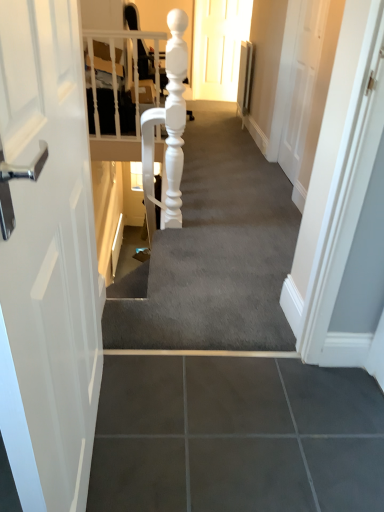
This screenshot has height=512, width=384. I want to click on matte white door at upper center, so click(218, 47).

Measure the distance between point (216, 10) and camera.

They are 17.95 feet apart.

Describe the element at coordinates (218, 47) in the screenshot. I see `matte white door at upper center` at that location.

Describe the element at coordinates (214, 255) in the screenshot. I see `smooth gray carpet at center` at that location.

Where is `smooth gray carpet at center`? This screenshot has height=512, width=384. smooth gray carpet at center is located at coordinates (214, 255).

At what (x,y) coordinates should I click in order to perform the action: click on matte white door at upper center. Please return your answer as a coordinate pair (x, y). The height and width of the screenshot is (512, 384). Looking at the image, I should click on point(218,47).

Which is more to the right, matte white door at upper center or smooth gray carpet at center?

matte white door at upper center.

Between matte white door at upper center and smooth gray carpet at center, which one is positioned in front?

smooth gray carpet at center is more forward.

Which point is more forward, (223, 89) or (158, 286)?

Positioned in front is point (158, 286).

From the image's perspective, is matte white door at upper center above or below smooth gray carpet at center?

From the image's perspective, matte white door at upper center appears above smooth gray carpet at center.

From a real-world perspective, does matte white door at upper center sit lower than smooth gray carpet at center?

No, from a real-world perspective, matte white door at upper center is not below smooth gray carpet at center.

Which object is wider, matte white door at upper center or smooth gray carpet at center?

Wider between the two is smooth gray carpet at center.

Considering the sizes of matte white door at upper center and smooth gray carpet at center in the image, is matte white door at upper center taller or shorter than smooth gray carpet at center?

In the image, matte white door at upper center appears to be taller than smooth gray carpet at center.

Which of these two, matte white door at upper center or smooth gray carpet at center, is smaller?

Smaller between the two is matte white door at upper center.

Can we say matte white door at upper center lies outside smooth gray carpet at center?

matte white door at upper center is positioned outside smooth gray carpet at center.

Would you consider matte white door at upper center to be distant from smooth gray carpet at center?

Yes, matte white door at upper center is far from smooth gray carpet at center.

In the scene shown: Is matte white door at upper center turned away from smooth gray carpet at center?

No, matte white door at upper center is not facing the opposite direction of smooth gray carpet at center.

Looking at this image, what's the angular difference between matte white door at upper center and smooth gray carpet at center's facing directions?

There is a 0.175-degree angle between the facing directions of matte white door at upper center and smooth gray carpet at center.

How much distance is there between matte white door at upper center and smooth gray carpet at center?

10.35 feet.

Where is `stairwell that is under the matte white door at upper center (from a real-world perspective)`? stairwell that is under the matte white door at upper center (from a real-world perspective) is located at coordinates (214, 255).

In the scene shown: Between smooth gray carpet at center and matte white door at upper center, which one appears on the left side from the viewer's perspective?

smooth gray carpet at center is more to the left.

Is smooth gray carpet at center closer to camera compared to matte white door at upper center?

Yes, the depth of smooth gray carpet at center is less than that of matte white door at upper center.

Considering the positions of points (223, 305) and (247, 3), is point (223, 305) farther from camera compared to point (247, 3)?

No.

From the image's perspective, would you say smooth gray carpet at center is shown under matte white door at upper center?

Yes, from the image's perspective, smooth gray carpet at center is beneath matte white door at upper center.

From a real-world perspective, who is located lower, smooth gray carpet at center or matte white door at upper center?

From a 3D spatial view, smooth gray carpet at center is below.

Can you confirm if smooth gray carpet at center is thinner than matte white door at upper center?

No.

Looking at this image, is smooth gray carpet at center taller or shorter than matte white door at upper center?

smooth gray carpet at center is shorter than matte white door at upper center.

Considering the relative sizes of smooth gray carpet at center and matte white door at upper center in the image provided, is smooth gray carpet at center smaller than matte white door at upper center?

Actually, smooth gray carpet at center might be larger than matte white door at upper center.

Is matte white door at upper center completely or partially inside smooth gray carpet at center?

Actually, matte white door at upper center is outside smooth gray carpet at center.

Is the surface of smooth gray carpet at center in direct contact with matte white door at upper center?

smooth gray carpet at center and matte white door at upper center are not in contact.

Could you tell me if smooth gray carpet at center is turned towards matte white door at upper center?

No, smooth gray carpet at center is not oriented towards matte white door at upper center.

At what (x,y) coordinates should I click in order to perform the action: click on door that is above the smooth gray carpet at center (from a real-world perspective). Please return your answer as a coordinate pair (x, y). Image resolution: width=384 pixels, height=512 pixels. Looking at the image, I should click on (218, 47).

I want to click on door above the smooth gray carpet at center (from a real-world perspective), so click(x=218, y=47).

The width and height of the screenshot is (384, 512). I want to click on stairwell in front of the matte white door at upper center, so click(214, 255).